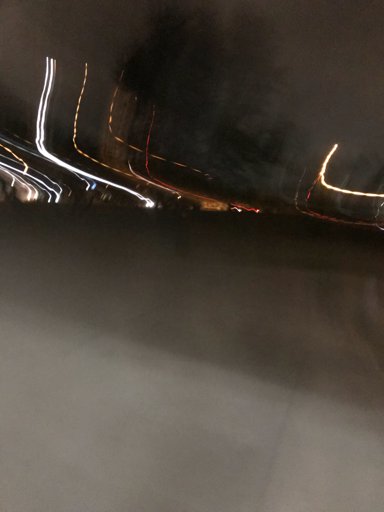
I want to click on yellow light, so click(x=25, y=165), click(x=327, y=180).